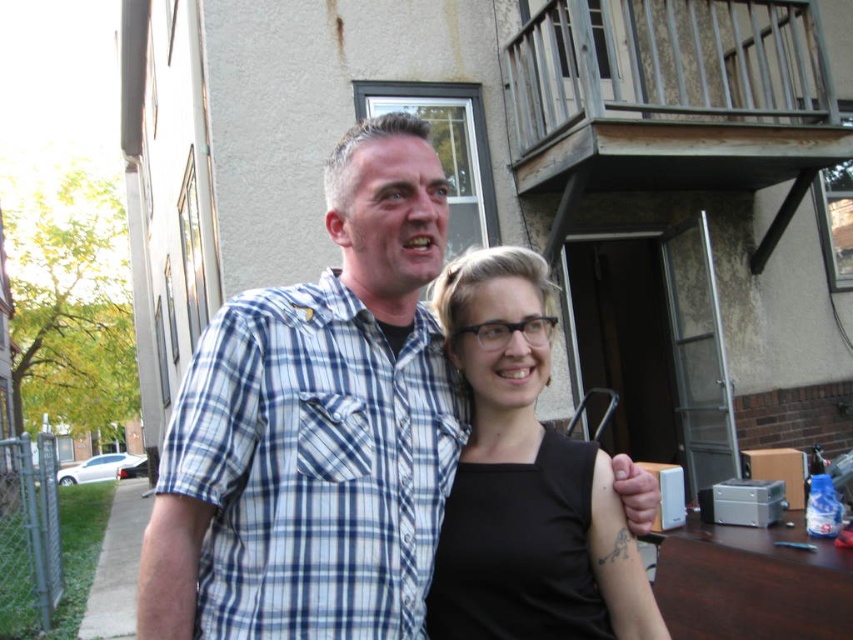
Can you confirm if blue plaid shirt at center is wider than black matte tank top at center?

Indeed, blue plaid shirt at center has a greater width compared to black matte tank top at center.

Can you confirm if blue plaid shirt at center is positioned above black matte tank top at center?

Yes.

The height and width of the screenshot is (640, 853). What do you see at coordinates (316, 428) in the screenshot? I see `blue plaid shirt at center` at bounding box center [316, 428].

Where is `blue plaid shirt at center`? This screenshot has width=853, height=640. blue plaid shirt at center is located at coordinates (316, 428).